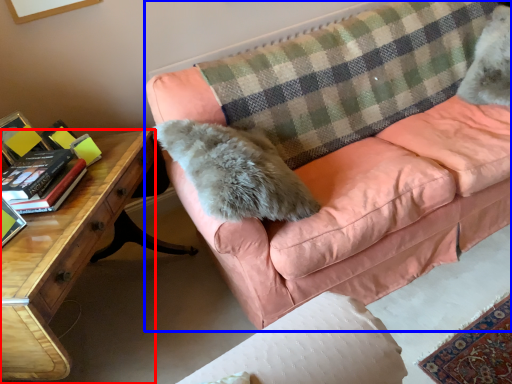
Question: Which object is further to the camera taking this photo, desk (highlighted by a red box) or studio couch (highlighted by a blue box)?

Choices:
 (A) desk
 (B) studio couch

Answer: (B)